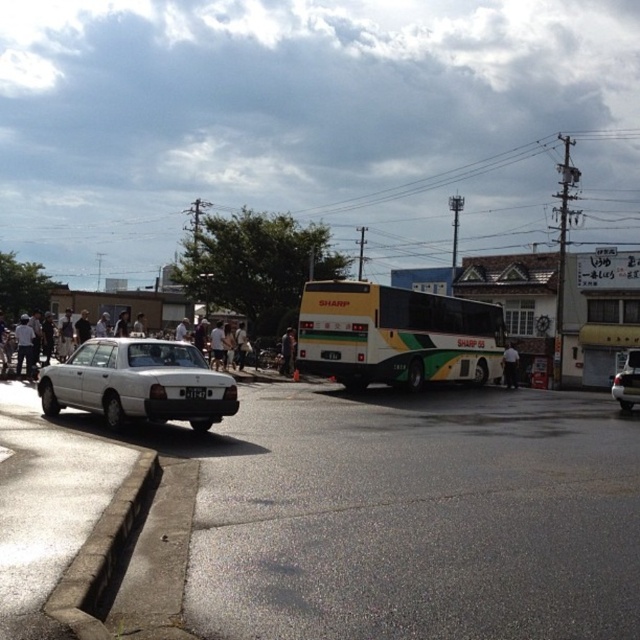
Question: Can you confirm if yellow-green painted bus at center is positioned above concrete at lower left?

Choices:
 (A) yes
 (B) no

Answer: (A)

Question: Which of the following is the closest to the observer?

Choices:
 (A) (461, 320)
 (B) (628, 406)
 (C) (209, 388)

Answer: (C)

Question: In this image, where is concrete at lower left located relative to satin silver sedan at lower right?

Choices:
 (A) left
 (B) right

Answer: (A)

Question: Among these points, which one is nearest to the camera?

Choices:
 (A) (188, 385)
 (B) (124, 481)
 (C) (236, 385)
 (D) (508, 372)

Answer: (B)

Question: Is white matte sedan at center positioned behind white fabric shirt at center-right?

Choices:
 (A) no
 (B) yes

Answer: (A)

Question: Which point is closer to the camera?

Choices:
 (A) (136, 464)
 (B) (202, 392)

Answer: (A)